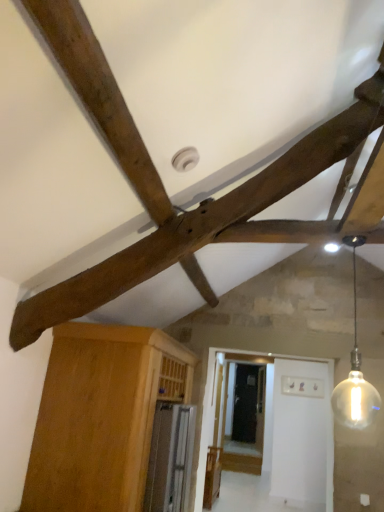
What do you see at coordinates (101, 416) in the screenshot? I see `wooden cabinet at lower left` at bounding box center [101, 416].

I want to click on wooden beam at upper center, so click(x=163, y=187).

Where is `wooden cabinet at lower left`? The width and height of the screenshot is (384, 512). wooden cabinet at lower left is located at coordinates (101, 416).

Considering the sizes of objects wooden beam at upper center and translucent glass bulb at upper right in the image provided, who is bigger, wooden beam at upper center or translucent glass bulb at upper right?

wooden beam at upper center is bigger.

From the image's perspective, does wooden beam at upper center appear higher than translucent glass bulb at upper right?

Yes, from the image's perspective, wooden beam at upper center is over translucent glass bulb at upper right.

Which object is closer to the camera, wooden beam at upper center or translucent glass bulb at upper right?

translucent glass bulb at upper right is closer to the camera.

Would you consider wooden cabinet at lower left to be distant from wooden beam at upper center?

No, wooden cabinet at lower left is not far from wooden beam at upper center.

Which is behind, point (132, 396) or point (165, 217)?

Point (132, 396)

Image resolution: width=384 pixels, height=512 pixels. I want to click on fan above the wooden cabinet at lower left (from a real-world perspective), so click(163, 187).

Considering the relative positions of wooden cabinet at lower left and wooden beam at upper center in the image provided, is wooden cabinet at lower left to the left of wooden beam at upper center from the viewer's perspective?

Yes, wooden cabinet at lower left is to the left of wooden beam at upper center.

From the image's perspective, is wooden cabinet at lower left located above or below translucent glass bulb at upper right?

From the image's perspective, wooden cabinet at lower left appears below translucent glass bulb at upper right.

Based on the photo, would you say wooden cabinet at lower left contains translucent glass bulb at upper right?

Actually, translucent glass bulb at upper right is outside wooden cabinet at lower left.

Based on the photo, considering the relative sizes of wooden cabinet at lower left and translucent glass bulb at upper right in the image provided, is wooden cabinet at lower left thinner than translucent glass bulb at upper right?

No.

Who is smaller, wooden cabinet at lower left or translucent glass bulb at upper right?

translucent glass bulb at upper right is smaller.

How far apart are translucent glass bulb at upper right and wooden beam at upper center?

translucent glass bulb at upper right and wooden beam at upper center are 2.34 meters apart.

Is translucent glass bulb at upper right at the left side of wooden beam at upper center?

Incorrect, translucent glass bulb at upper right is not on the left side of wooden beam at upper center.

Is translucent glass bulb at upper right far from wooden beam at upper center?

Yes, translucent glass bulb at upper right and wooden beam at upper center are located far from each other.

Is the depth of translucent glass bulb at upper right less than that of wooden beam at upper center?

Yes, the depth of translucent glass bulb at upper right is less than that of wooden beam at upper center.

Is point (336, 413) less distant than point (140, 485)?

No, (336, 413) is behind (140, 485).

Is translucent glass bulb at upper right behind wooden cabinet at lower left?

No, translucent glass bulb at upper right is closer to the camera.

What's the angular difference between translucent glass bulb at upper right and wooden cabinet at lower left's facing directions?

The angle between the facing direction of translucent glass bulb at upper right and the facing direction of wooden cabinet at lower left is 86.9 degrees.

Is translucent glass bulb at upper right oriented away from wooden cabinet at lower left?

That's not correct — translucent glass bulb at upper right is not looking away from wooden cabinet at lower left.

Which is in front, wooden beam at upper center or wooden cabinet at lower left?

wooden beam at upper center is more forward.

Where is `fan on the right of wooden cabinet at lower left`? fan on the right of wooden cabinet at lower left is located at coordinates (163, 187).

Is wooden beam at upper center facing away from wooden cabinet at lower left?

No, wooden cabinet at lower left is not at the back of wooden beam at upper center.

Image resolution: width=384 pixels, height=512 pixels. What are the coordinates of `fan above the translucent glass bulb at upper right (from a real-world perspective)` in the screenshot? It's located at (163, 187).

Locate an element on the screen. fan located above the wooden cabinet at lower left (from the image's perspective) is located at coordinates (163, 187).

From the image, which object appears to be farther from wooden beam at upper center, wooden cabinet at lower left or translucent glass bulb at upper right?

translucent glass bulb at upper right is positioned further to the anchor wooden beam at upper center.

Estimate the real-world distances between objects in this image. Which object is further from wooden cabinet at lower left, translucent glass bulb at upper right or wooden beam at upper center?

Based on the image, translucent glass bulb at upper right appears to be further to wooden cabinet at lower left.

From the image, which object appears to be nearer to wooden beam at upper center, translucent glass bulb at upper right or wooden cabinet at lower left?

wooden cabinet at lower left.

Considering their positions, is wooden beam at upper center positioned closer to translucent glass bulb at upper right than wooden cabinet at lower left?

wooden cabinet at lower left.

When comparing their distances from wooden cabinet at lower left, does wooden beam at upper center or translucent glass bulb at upper right seem further?

translucent glass bulb at upper right lies further to wooden cabinet at lower left than the other object.

When comparing their distances from translucent glass bulb at upper right, does wooden cabinet at lower left or wooden beam at upper center seem further?

Among the two, wooden beam at upper center is located further to translucent glass bulb at upper right.

I want to click on light fixture that lies between wooden beam at upper center and wooden cabinet at lower left from top to bottom, so click(355, 375).